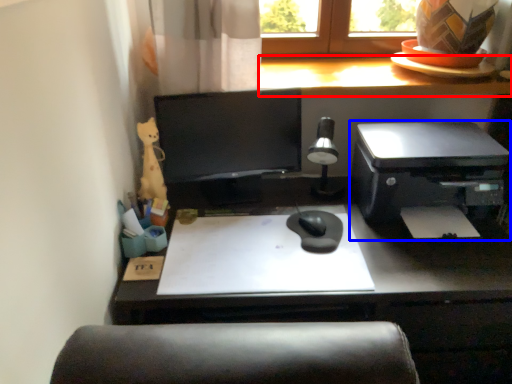
Question: Which point is further to the camera, counter top (highlighted by a red box) or printer (highlighted by a blue box)?

Choices:
 (A) counter top
 (B) printer

Answer: (A)